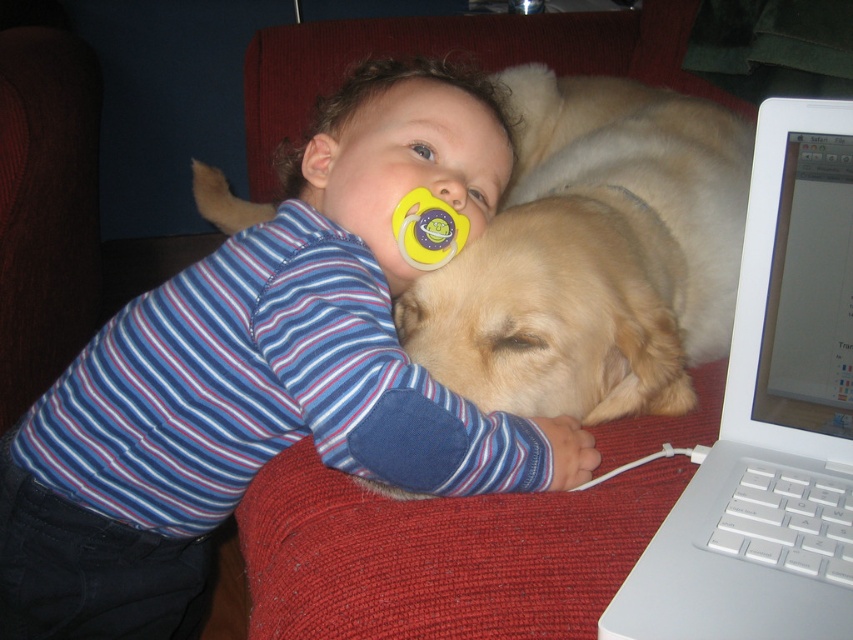
Based on the scene description, where is the golden fur dog at center located in the image?

The golden fur dog at center is located at point (593, 256) in the image.

You are taking a photo of the golden fur dog at center. The camera is 27.01 inches away from the dog. If the camera has a focal length of 50mm and the dog occupies 800 pixels in the image, what is the actual width of the dog in inches?

Using the formula pixel width x focal length divided by subject distance equals actual width, the calculation would be 800 pixels x 50mm divided by 27.01 inches. However, this requires converting units properly. Since focal length is in millimeters and distance is in inches, the actual width would be approximately 148.1 inches. But this seems unrealistic, so there might be an error in unit conversion or assumptions. Please verify the units and recalculate.

You are a photographer trying to capture a closeup of the child and dog. You have a camera with a 12cm wide lens. The blue striped shirt at upper left and yellow rubber pacifier at upper center are in your frame. Which object should you focus on to ensure the lens can fully capture it?

The yellow rubber pacifier at upper center should be focused on because the blue striped shirt at upper left might be wider than the yellow rubber pacifier at upper center, so the pacifier is likely narrower and fits within the 12cm lens width.